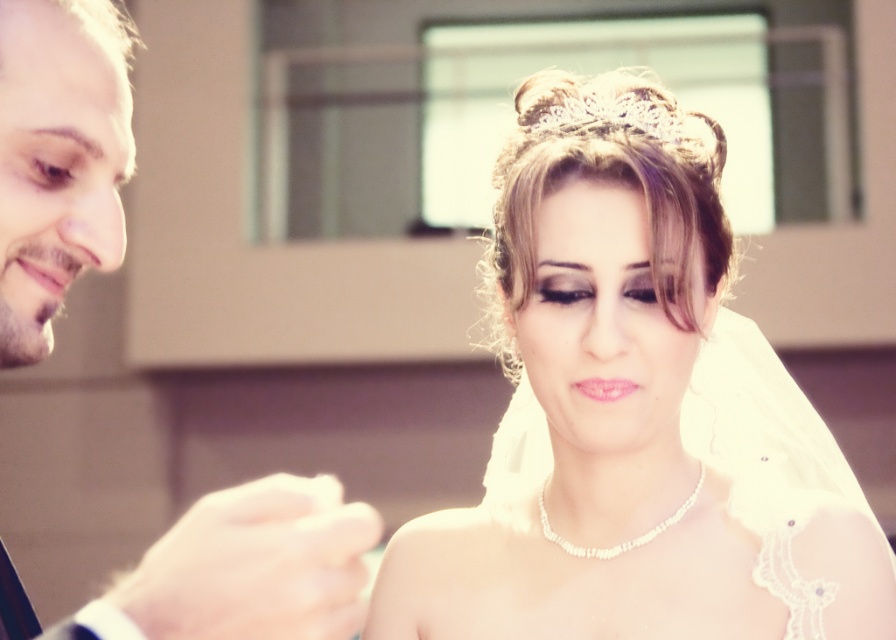
You are a photographer adjusting the focus of your camera. You want to ensure both the ivory satin veil at upper center and the smooth skin face at left are in focus. Which object should you focus on first to achieve this?

The ivory satin veil at upper center is further to the viewer than the smooth skin face at left. To get both in focus, you should focus on the ivory satin veil at upper center first, as it is closer, and the depth of field will extend backward to include the smooth skin face at left.

You are a makeup artist preparing the bride for her wedding photos. You need to apply blush to the smooth skin face at left. Considering the ivory satin veil at upper center is in the way, which side of the face should you target to avoid the veil?

The ivory satin veil at upper center is positioned on the right side of smooth skin face at left, so you should apply blush to the left side of the smooth skin face at left to avoid the veil.